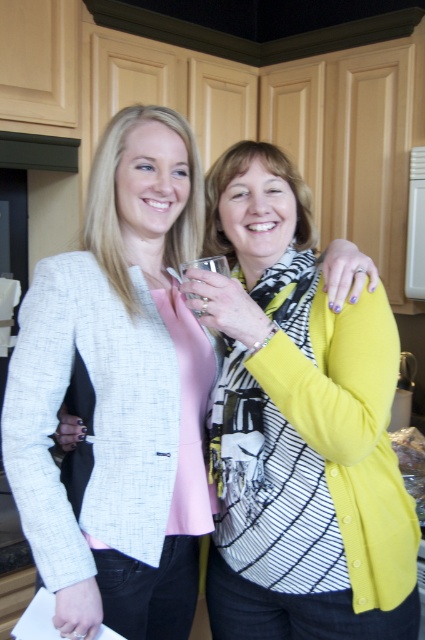
Question: Among these points, which one is nearest to the camera?

Choices:
 (A) (181, 273)
 (B) (113, 435)

Answer: (B)

Question: Is matte yellow cardigan at center closer to the viewer compared to clear glass at center?

Choices:
 (A) no
 (B) yes

Answer: (B)

Question: Which of the following is the closest to the observer?

Choices:
 (A) matte yellow cardigan at center
 (B) clear glass at center

Answer: (A)

Question: Is matte yellow cardigan at center to the right of clear glass at center from the viewer's perspective?

Choices:
 (A) no
 (B) yes

Answer: (A)

Question: Can you confirm if matte yellow cardigan at center is positioned to the left of clear glass at center?

Choices:
 (A) no
 (B) yes

Answer: (B)